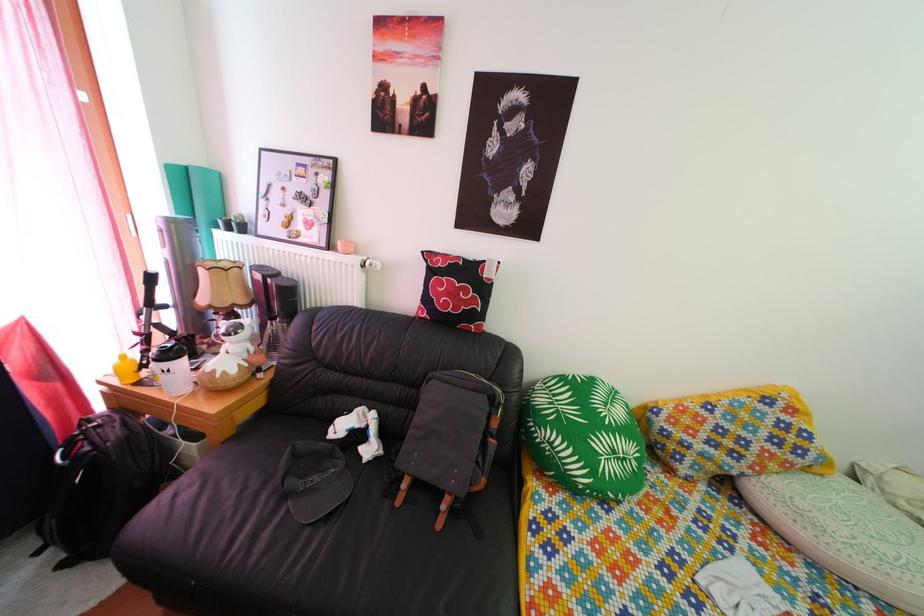
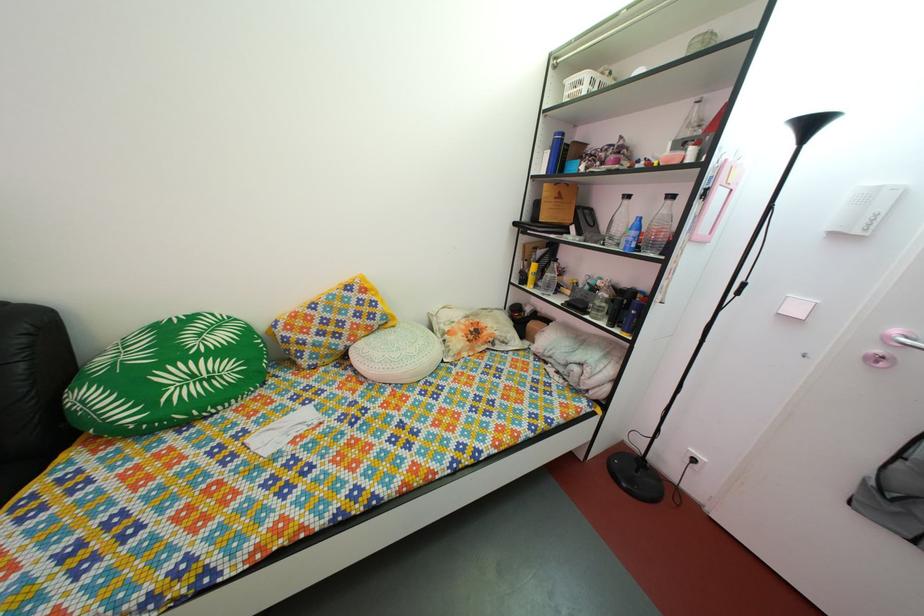
Where in the second image is the point corresponding to point (744, 482) from the first image?

(349, 357)